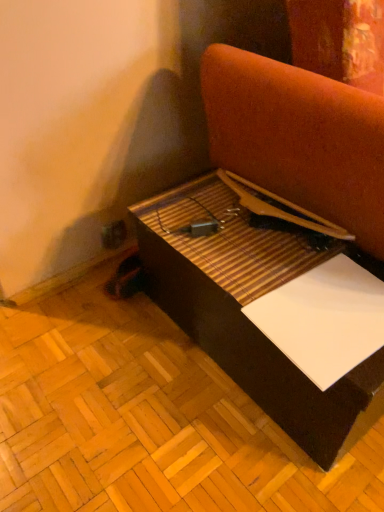
Identify the location of vacant space positioned to the left of black wood table at lower right. (100, 377).